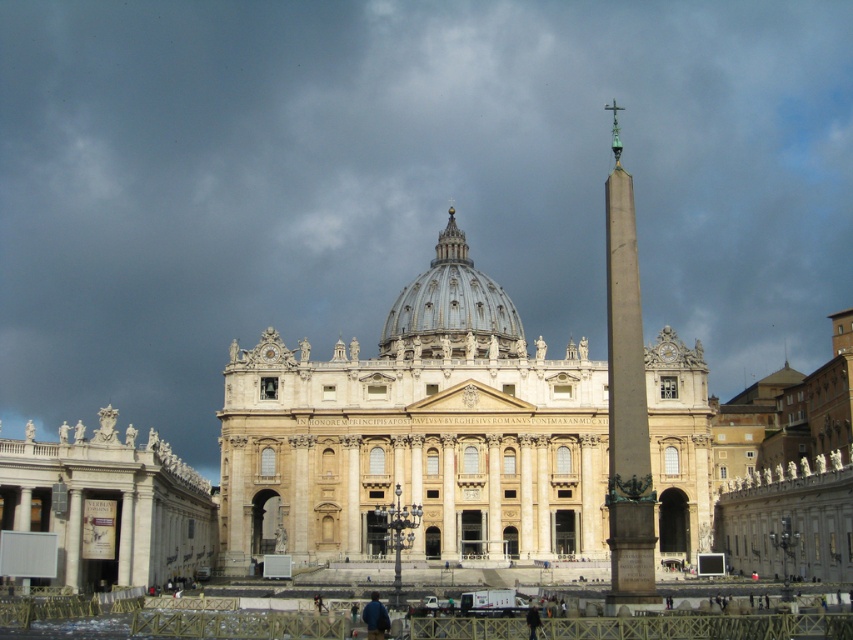
You are an architect examining the cathedral and its surroundings. You notice the white marble statues at left and the polished bronze obelisk at right. Based on their positions, which one is closer to the ground?

The white marble statues at left is located below the polished bronze obelisk at right, meaning it is closer to the ground than the obelisk.

You are an architect analyzing the cathedral layout. The light beige stone palace at center and the white marble dome at center are key elements. Which of these two structures is located below the other?

The light beige stone palace at center is positioned under the white marble dome at center, meaning the palace is below the dome.